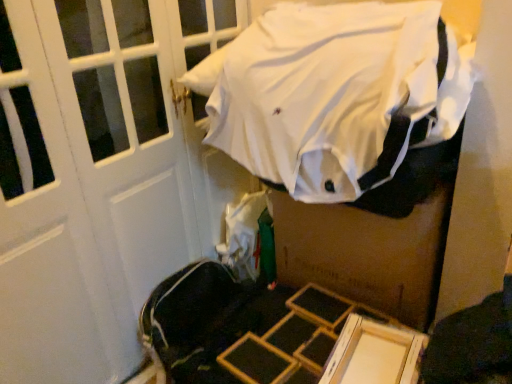
The image size is (512, 384). Describe the element at coordinates (335, 94) in the screenshot. I see `white fabric shirt at upper center` at that location.

At what (x,y) coordinates should I click in order to perform the action: click on white fabric shirt at upper center. Please return your answer as a coordinate pair (x, y). The width and height of the screenshot is (512, 384). Looking at the image, I should click on [x=335, y=94].

Describe the element at coordinates (366, 253) in the screenshot. I see `brown cardboard box at center` at that location.

The width and height of the screenshot is (512, 384). Identify the location of brown cardboard box at center. (366, 253).

Where is `white fabric shirt at upper center`? The image size is (512, 384). white fabric shirt at upper center is located at coordinates pyautogui.click(x=335, y=94).

Considering the relative positions of white fabric shirt at upper center and brown cardboard box at center in the image provided, is white fabric shirt at upper center to the left or to the right of brown cardboard box at center?

Based on their positions, white fabric shirt at upper center is located to the left of brown cardboard box at center.

Between white fabric shirt at upper center and brown cardboard box at center, which one is positioned in front?

white fabric shirt at upper center is closer to the camera.

Between point (433, 4) and point (354, 245), which one is positioned behind?

The point (354, 245) is behind.

From the image's perspective, is white fabric shirt at upper center positioned above or below brown cardboard box at center?

Based on their image positions, white fabric shirt at upper center is located above brown cardboard box at center.

From a real-world perspective, does white fabric shirt at upper center stand above brown cardboard box at center?

Indeed, from a real-world perspective, white fabric shirt at upper center stands above brown cardboard box at center.

Is white fabric shirt at upper center wider than brown cardboard box at center?

Correct, the width of white fabric shirt at upper center exceeds that of brown cardboard box at center.

Does white fabric shirt at upper center have a lesser height compared to brown cardboard box at center?

Correct, white fabric shirt at upper center is not as tall as brown cardboard box at center.

Is white fabric shirt at upper center bigger or smaller than brown cardboard box at center?

Clearly, white fabric shirt at upper center is larger in size than brown cardboard box at center.

Is brown cardboard box at center completely or partially inside white fabric shirt at upper center?

No, brown cardboard box at center is not a part of white fabric shirt at upper center.

Is white fabric shirt at upper center not close to brown cardboard box at center?

white fabric shirt at upper center is near brown cardboard box at center, not far away.

Is white fabric shirt at upper center positioned with its back to brown cardboard box at center?

No, white fabric shirt at upper center is not facing the opposite direction of brown cardboard box at center.

How different are the orientations of white fabric shirt at upper center and brown cardboard box at center in degrees?

There is a 5.4e-06-degree angle between the facing directions of white fabric shirt at upper center and brown cardboard box at center.

Measure the distance between white fabric shirt at upper center and brown cardboard box at center.

The distance of white fabric shirt at upper center from brown cardboard box at center is 33.01 centimeters.

Where is `sheet in front of the brown cardboard box at center`? This screenshot has height=384, width=512. sheet in front of the brown cardboard box at center is located at coordinates pyautogui.click(x=335, y=94).

Does brown cardboard box at center appear on the left side of white fabric shirt at upper center?

In fact, brown cardboard box at center is to the right of white fabric shirt at upper center.

Which is behind, brown cardboard box at center or white fabric shirt at upper center?

brown cardboard box at center is further from the camera.

Does point (426, 296) lie behind point (407, 145)?

Yes.

From the image's perspective, who appears lower, brown cardboard box at center or white fabric shirt at upper center?

brown cardboard box at center appears lower in the image.

Looking at this image, from a real-world perspective, is brown cardboard box at center beneath white fabric shirt at upper center?

Yes, from a real-world perspective, brown cardboard box at center is beneath white fabric shirt at upper center.

Is brown cardboard box at center wider or thinner than white fabric shirt at upper center?

Considering their sizes, brown cardboard box at center looks slimmer than white fabric shirt at upper center.

From their relative heights in the image, would you say brown cardboard box at center is taller or shorter than white fabric shirt at upper center?

Clearly, brown cardboard box at center is taller compared to white fabric shirt at upper center.

Who is bigger, brown cardboard box at center or white fabric shirt at upper center?

white fabric shirt at upper center is bigger.

Is brown cardboard box at center located outside white fabric shirt at upper center?

Yes.

Would you consider brown cardboard box at center to be distant from white fabric shirt at upper center?

No, there isn't a large distance between brown cardboard box at center and white fabric shirt at upper center.

Is white fabric shirt at upper center at the back of brown cardboard box at center?

No.

How many degrees apart are the facing directions of brown cardboard box at center and white fabric shirt at upper center?

The angular difference between brown cardboard box at center and white fabric shirt at upper center is 5.4e-06 degrees.

This screenshot has width=512, height=384. In the image, there is a brown cardboard box at center. Identify the location of sheet above it (from the image's perspective). (335, 94).

The image size is (512, 384). In order to click on sheet located above the brown cardboard box at center (from a real-world perspective) in this screenshot , I will do `click(335, 94)`.

Locate an element on the screen. The width and height of the screenshot is (512, 384). box beneath the white fabric shirt at upper center (from a real-world perspective) is located at coordinates (366, 253).